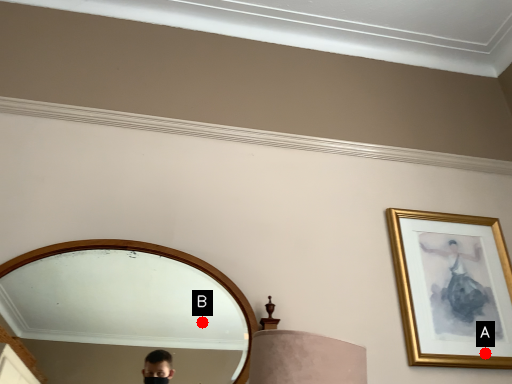
Question: Two points are circled on the image, labeled by A and B beside each circle. Which point appears closest to the camera in this image?

Choices:
 (A) A is closer
 (B) B is closer

Answer: (B)